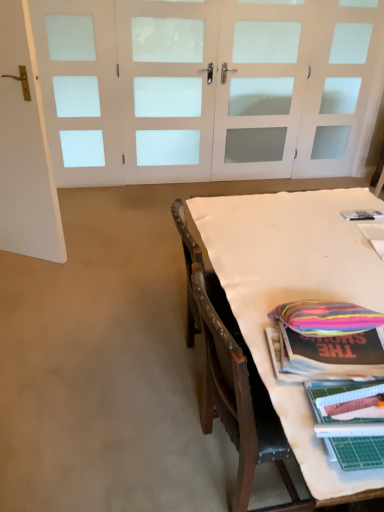
Question: From the image's perspective, relative to white frosted glass door at upper center, which is the second door from front to back, is white matte door at left, placed as the 2th door when sorted from right to left, above or below?

Choices:
 (A) above
 (B) below

Answer: (B)

Question: In terms of height, does white matte door at left, placed as the 2th door when sorted from right to left, look taller or shorter compared to white frosted glass door at upper center, the second door positioned from the left?

Choices:
 (A) tall
 (B) short

Answer: (B)

Question: Estimate the real-world distances between objects in this image. Which object is closer to the white fabric-covered table at lower right?

Choices:
 (A) white frosted glass door at upper center, the second door positioned from the left
 (B) white matte door at left, placed as the 2th door when sorted from right to left

Answer: (B)

Question: Estimate the real-world distances between objects in this image. Which object is farther from the white frosted glass door at upper center, which is the second door from front to back?

Choices:
 (A) white fabric-covered table at lower right
 (B) white matte door at left, the 1th door in the left-to-right sequence

Answer: (A)